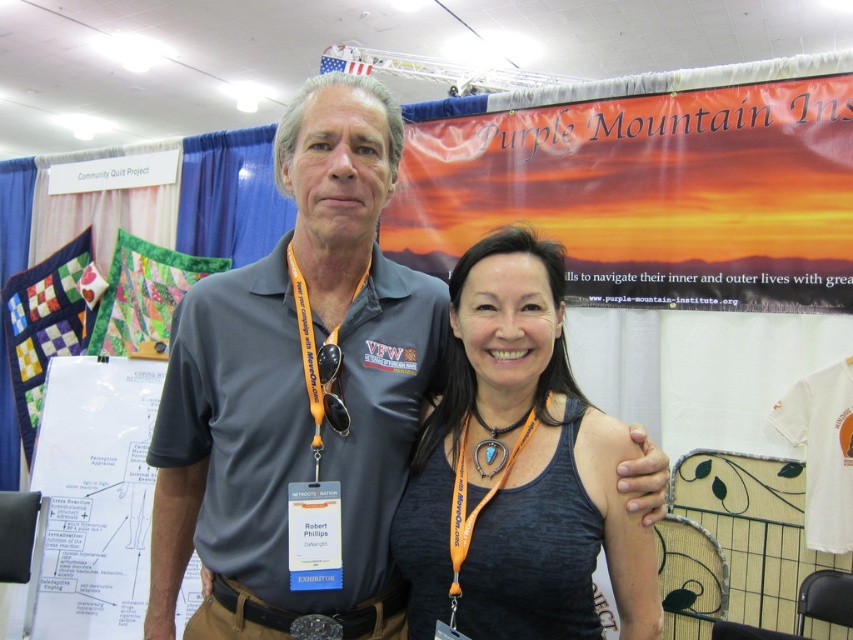
Question: Which of the following is the farthest from the observer?

Choices:
 (A) (181, 570)
 (B) (469, 611)
 (C) (343, 435)

Answer: (A)

Question: Where is gray fabric shirt at center located in relation to turquoise stone pendant at center in the image?

Choices:
 (A) left
 (B) right

Answer: (A)

Question: Can you confirm if gray fabric shirt at center is positioned to the right of dark gray tank top at center?

Choices:
 (A) no
 (B) yes

Answer: (A)

Question: Among these points, which one is nearest to the camera?

Choices:
 (A) (483, 461)
 (B) (335, 381)
 (C) (163, 600)

Answer: (B)

Question: Which point is closer to the camera?

Choices:
 (A) dark gray tank top at center
 (B) orange fabric lanyard at center
 (C) turquoise stone pendant at center
 (D) gray fabric shirt at center

Answer: (A)

Question: Does dark gray tank top at center have a greater width compared to turquoise stone pendant at center?

Choices:
 (A) yes
 (B) no

Answer: (A)